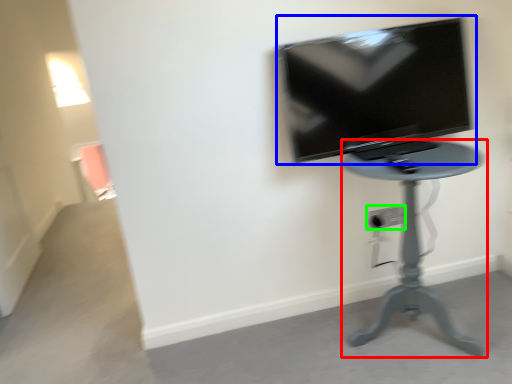
Question: Which object is positioned farthest from furniture (highlighted by a red box)? Select from television (highlighted by a blue box) and electric outlet (highlighted by a green box).

Choices:
 (A) television
 (B) electric outlet

Answer: (B)